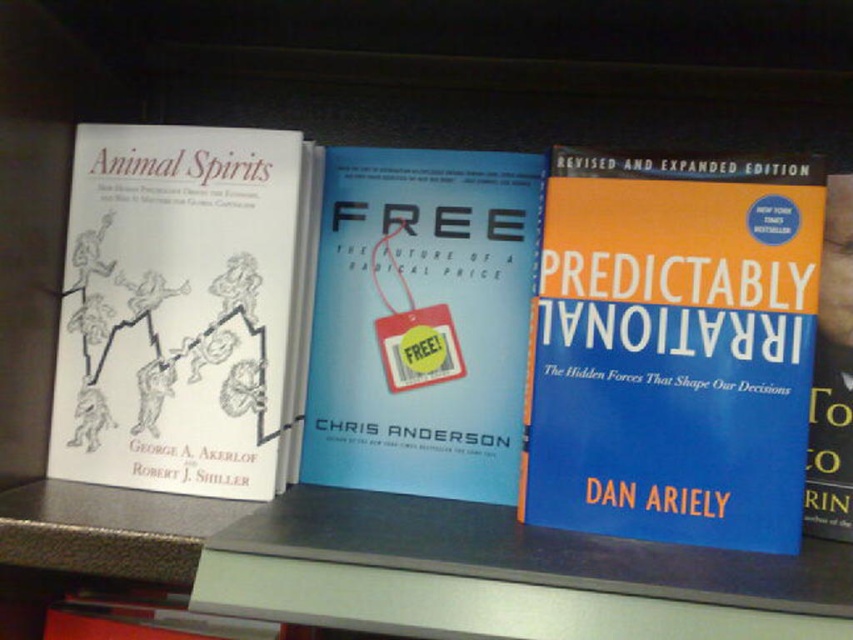
Looking at this image, you are organizing a library shelf and need to place the white paper at left and the blue matte book at center. Based on their positions, which item should you adjust first to ensure proper alignment?

The white paper at left should be adjusted first because it is closer to the viewer than the blue matte book at center, making it the first item needing alignment.

Which book is positioned to the right of the other between the blue hardcover book at center and the blue matte book at center?

The blue hardcover book at center is positioned to the right of the blue matte book at center.